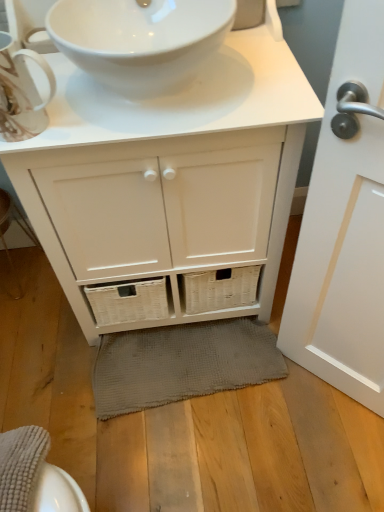
Question: Which is correct: white glossy door handle at right is inside matte white teacup at upper left, or outside of it?

Choices:
 (A) outside
 (B) inside

Answer: (A)

Question: Would you say white glossy door handle at right is to the left or to the right of matte white teacup at upper left in the picture?

Choices:
 (A) right
 (B) left

Answer: (A)

Question: Which object is positioned closest to the gray textured bath mat at lower center?

Choices:
 (A) white glossy sink at upper center
 (B) white matte cabinet at center
 (C) matte white teacup at upper left
 (D) white glossy door handle at right

Answer: (B)

Question: Estimate the real-world distances between objects in this image. Which object is farther from the matte white teacup at upper left?

Choices:
 (A) white glossy door handle at right
 (B) white glossy sink at upper center
 (C) gray textured bath mat at lower center
 (D) white matte cabinet at center

Answer: (C)